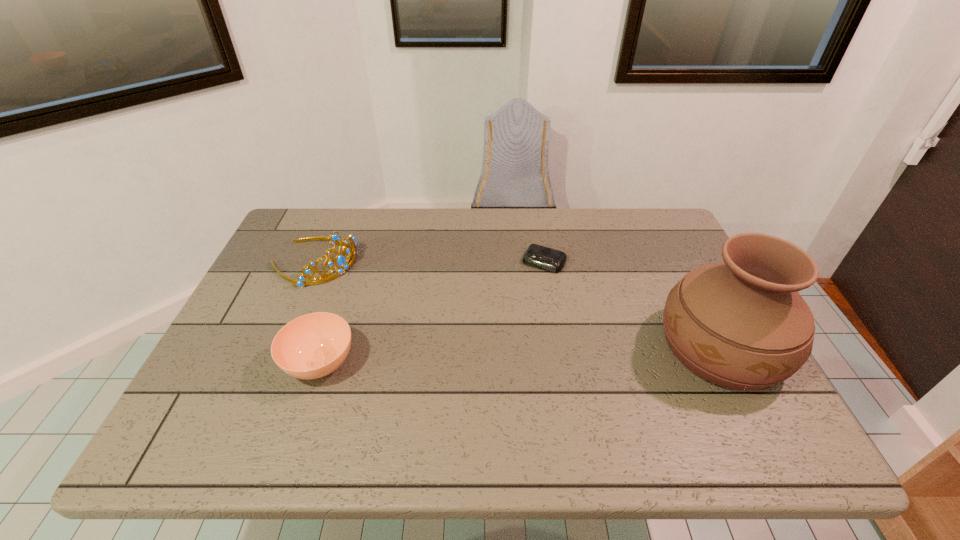
In order to click on free space on the desktop that is between the soup bowl and the tallest object and is positioned on the display of the alarm clock in this screenshot , I will do `click(491, 356)`.

The height and width of the screenshot is (540, 960). In order to click on free space on the desktop that is between the second shortest object and the urn and is positioned on the front-facing side of the second tallest object in this screenshot , I will do `click(504, 356)`.